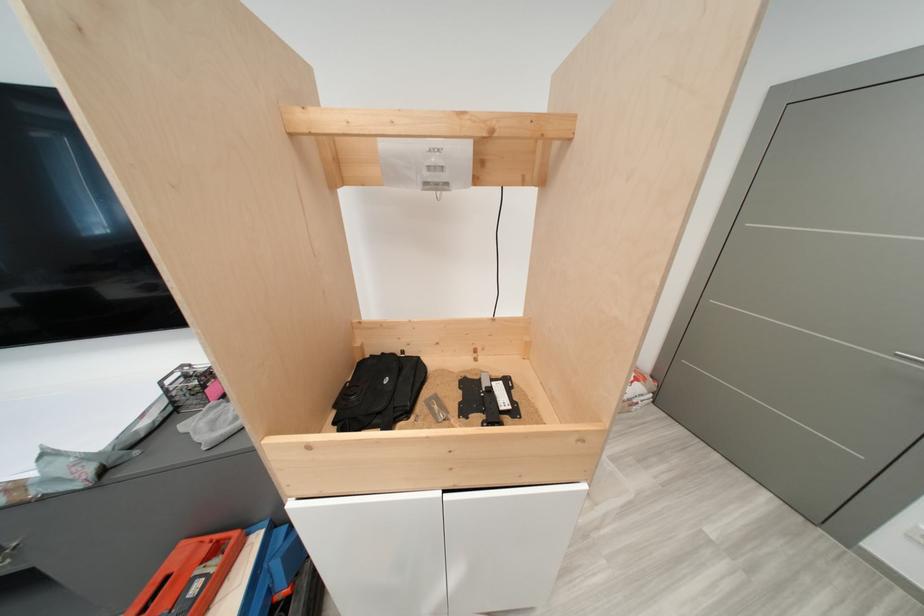
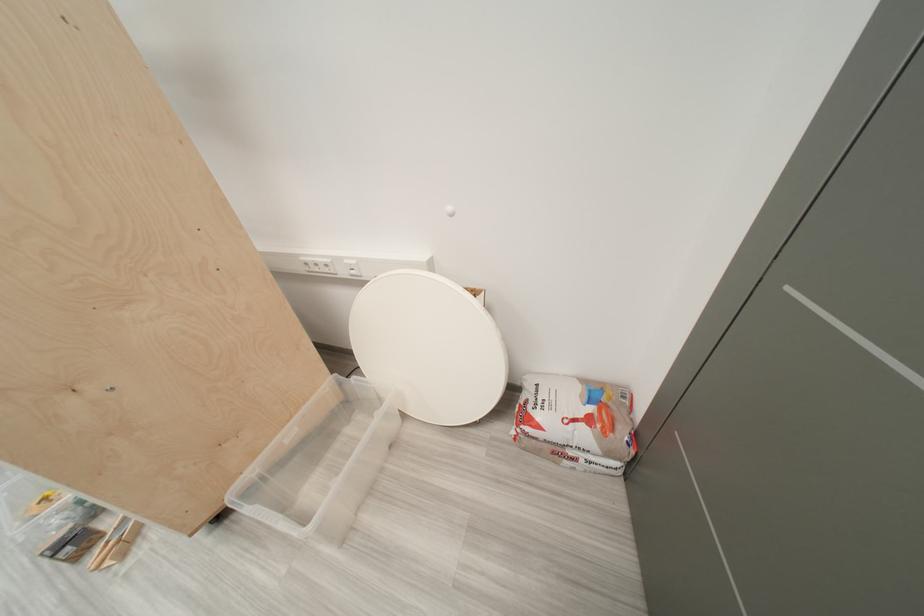
Where in the second image is the point corresponding to the point at 645,410 from the first image?

(577, 464)